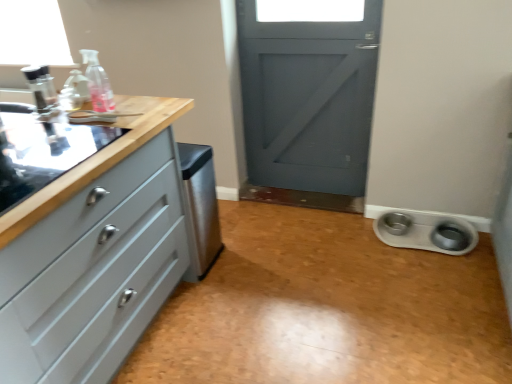
What are the coordinates of `vacant space in between white plastic pet bowls at lower right and satin stainless steel dishwasher at center` in the screenshot? It's located at (309, 251).